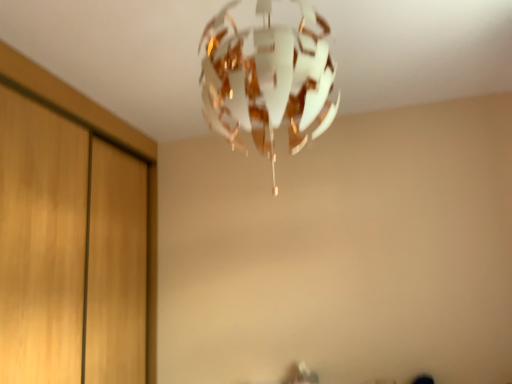
Locate an element on the screen. Image resolution: width=512 pixels, height=384 pixels. white paper lamp at upper center is located at coordinates (268, 80).

This screenshot has width=512, height=384. What do you see at coordinates (268, 80) in the screenshot? I see `white paper lamp at upper center` at bounding box center [268, 80].

This screenshot has width=512, height=384. What do you see at coordinates (106, 140) in the screenshot?
I see `wooden dresser at left` at bounding box center [106, 140].

The height and width of the screenshot is (384, 512). Find the location of `wooden dresser at left`. wooden dresser at left is located at coordinates (106, 140).

Image resolution: width=512 pixels, height=384 pixels. Find the location of `white paper lamp at upper center`. white paper lamp at upper center is located at coordinates (268, 80).

Consider the image. Is white paper lamp at upper center to the right of wooden dresser at left from the viewer's perspective?

Indeed, white paper lamp at upper center is positioned on the right side of wooden dresser at left.

Consider the image. Which is in front, white paper lamp at upper center or wooden dresser at left?

white paper lamp at upper center is in front.

Is point (242, 64) closer or farther from the camera than point (24, 91)?

Point (242, 64).

From the image's perspective, between white paper lamp at upper center and wooden dresser at left, who is located below?

wooden dresser at left appears lower in the image.

Looking at this image, from a real-world perspective, between white paper lamp at upper center and wooden dresser at left, who is vertically higher?

From a 3D spatial view, white paper lamp at upper center is above.

Which object is wider, white paper lamp at upper center or wooden dresser at left?

Wider between the two is white paper lamp at upper center.

Considering the relative sizes of white paper lamp at upper center and wooden dresser at left in the image provided, is white paper lamp at upper center taller than wooden dresser at left?

No, white paper lamp at upper center is not taller than wooden dresser at left.

In terms of size, does white paper lamp at upper center appear bigger or smaller than wooden dresser at left?

Clearly, white paper lamp at upper center is smaller in size than wooden dresser at left.

Is white paper lamp at upper center inside or outside of wooden dresser at left?

white paper lamp at upper center is outside wooden dresser at left.

Based on the photo, is white paper lamp at upper center positioned far away from wooden dresser at left?

Absolutely, white paper lamp at upper center is distant from wooden dresser at left.

Is white paper lamp at upper center facing away from wooden dresser at left?

No, white paper lamp at upper center is not facing away from wooden dresser at left.

How different are the orientations of white paper lamp at upper center and wooden dresser at left in degrees?

white paper lamp at upper center and wooden dresser at left are facing 90.2 degrees away from each other.

How far apart are white paper lamp at upper center and wooden dresser at left?

A distance of 4.41 feet exists between white paper lamp at upper center and wooden dresser at left.

At what (x,y) coordinates should I click in order to perform the action: click on lamp on the right of the wooden dresser at left. Please return your answer as a coordinate pair (x, y). The width and height of the screenshot is (512, 384). Looking at the image, I should click on (268, 80).

Does wooden dresser at left appear on the left side of white paper lamp at upper center?

Yes, wooden dresser at left is to the left of white paper lamp at upper center.

In the image, is wooden dresser at left positioned in front of or behind white paper lamp at upper center?

wooden dresser at left is behind white paper lamp at upper center.

Considering the positions of points (36, 71) and (312, 66), is point (36, 71) closer to camera compared to point (312, 66)?

That is False.

From the image's perspective, which is below, wooden dresser at left or white paper lamp at upper center?

wooden dresser at left, from the image's perspective.

From a real-world perspective, which is physically below, wooden dresser at left or white paper lamp at upper center?

wooden dresser at left, from a real-world perspective.

Is wooden dresser at left wider than white paper lamp at upper center?

No.

Who is taller, wooden dresser at left or white paper lamp at upper center?

Standing taller between the two is wooden dresser at left.

Between wooden dresser at left and white paper lamp at upper center, which one has smaller size?

white paper lamp at upper center is smaller.

Based on the photo, is wooden dresser at left outside of white paper lamp at upper center?

Absolutely, wooden dresser at left is external to white paper lamp at upper center.

Is wooden dresser at left with white paper lamp at upper center?

wooden dresser at left and white paper lamp at upper center are not in contact.

Is wooden dresser at left oriented away from white paper lamp at upper center?

No, wooden dresser at left is not facing the opposite direction of white paper lamp at upper center.

What's the angular difference between wooden dresser at left and white paper lamp at upper center's facing directions?

90.2 degrees.

This screenshot has width=512, height=384. Find the location of `lamp in front of the wooden dresser at left`. lamp in front of the wooden dresser at left is located at coordinates (268, 80).

You are a GUI agent. You are given a task and a screenshot of the screen. Output one action in this format:
    pyautogui.click(x=<x>, y=<y>)
    Task: Click on the dresser that appears below the white paper lamp at upper center (from the image's perspective)
    The height and width of the screenshot is (384, 512).
    Given the screenshot: What is the action you would take?
    pyautogui.click(x=106, y=140)

This screenshot has height=384, width=512. In order to click on dresser behind the white paper lamp at upper center in this screenshot , I will do `click(106, 140)`.